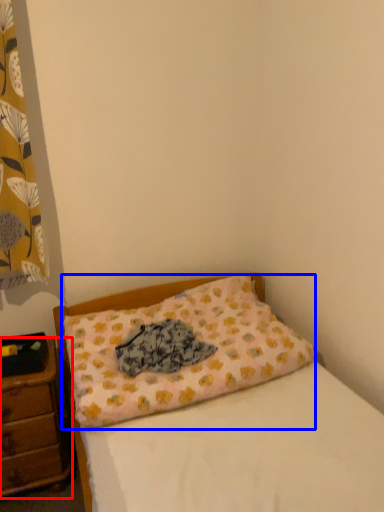
Question: Which point is further to the camera, nightstand (highlighted by a red box) or pillow (highlighted by a blue box)?

Choices:
 (A) nightstand
 (B) pillow

Answer: (A)